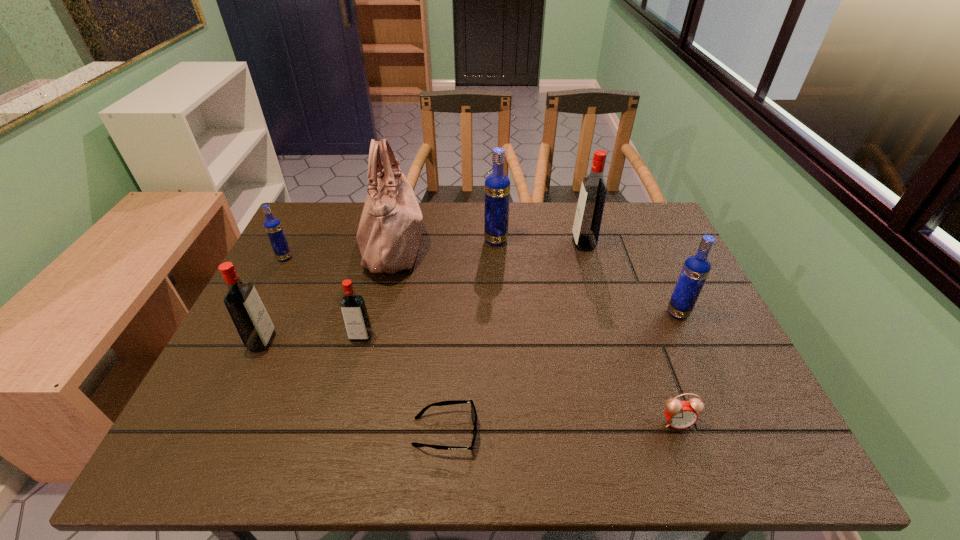
This screenshot has width=960, height=540. Identify the location of handbag. (389, 232).

Identify the location of the rightmost red vodka. (588, 217).

The width and height of the screenshot is (960, 540). Identify the location of the farthest red vodka. (588, 217).

You are a GUI agent. You are given a task and a screenshot of the screen. Output one action in this format:
    pyautogui.click(x=<x>, y=<y>)
    Task: Click on the second blue vodka from right to left
    
    Given the screenshot: What is the action you would take?
    pyautogui.click(x=497, y=185)

Where is `the biggest blue vodka`? The image size is (960, 540). the biggest blue vodka is located at coordinates (497, 185).

Find the location of a particular element. The image size is (960, 540). the second object from left to right is located at coordinates (255, 328).

What are the coordinates of `the second smallest red vodka` in the screenshot? It's located at (255, 328).

The image size is (960, 540). What are the coordinates of `the rightmost object` in the screenshot? It's located at (696, 268).

This screenshot has width=960, height=540. What are the coordinates of `the rightmost vodka` in the screenshot? It's located at (696, 268).

Image resolution: width=960 pixels, height=540 pixels. In order to click on the smallest blue vodka in this screenshot , I will do `click(273, 227)`.